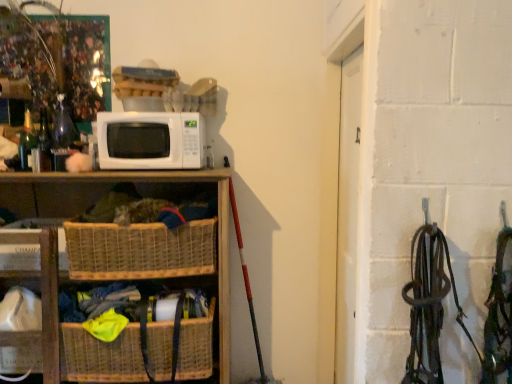
Question: Considering the positions of green glass bottle at left and woven wood basket at lower left, arranged as the 2th shelf when viewed from the right, in the image, is green glass bottle at left bigger or smaller than woven wood basket at lower left, arranged as the 2th shelf when viewed from the right,?

Choices:
 (A) small
 (B) big

Answer: (A)

Question: From the image's perspective, is green glass bottle at left positioned above or below woven wood basket at lower left, the first shelf from the left?

Choices:
 (A) above
 (B) below

Answer: (A)

Question: Which object is positioned closest to the woven brown basket at lower left, which is the 2th basket from bottom to top?

Choices:
 (A) green glass bottle at left
 (B) white matte microwave at center
 (C) woven wood basket at lower left, arranged as the 2th shelf when viewed from the right
 (D) woven wood shelf at lower left, which ranks as the 2th shelf in left-to-right order
 (E) woven brown basket at lower center, marked as the 2th basket in a top-to-bottom arrangement

Answer: (D)

Question: Estimate the real-world distances between objects in this image. Which object is farther from the woven brown basket at lower center, the 1th basket from the bottom?

Choices:
 (A) woven wood basket at lower left, arranged as the 2th shelf when viewed from the right
 (B) white matte microwave at center
 (C) woven wood shelf at lower left, which ranks as the 2th shelf in left-to-right order
 (D) green glass bottle at left
 (E) woven brown basket at lower left, which is the first basket in top-to-bottom order

Answer: (D)